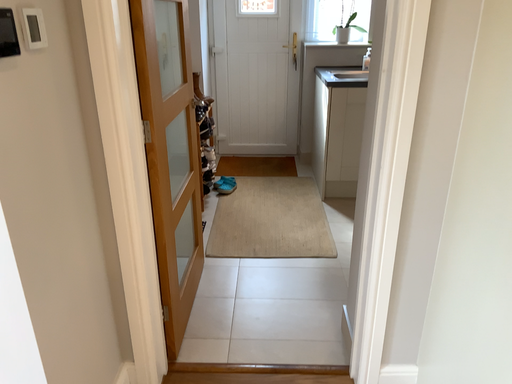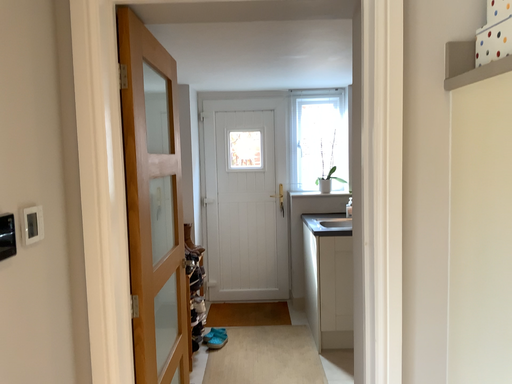
Question: How did the camera likely rotate when shooting the video?

Choices:
 (A) rotated upward
 (B) rotated downward

Answer: (A)